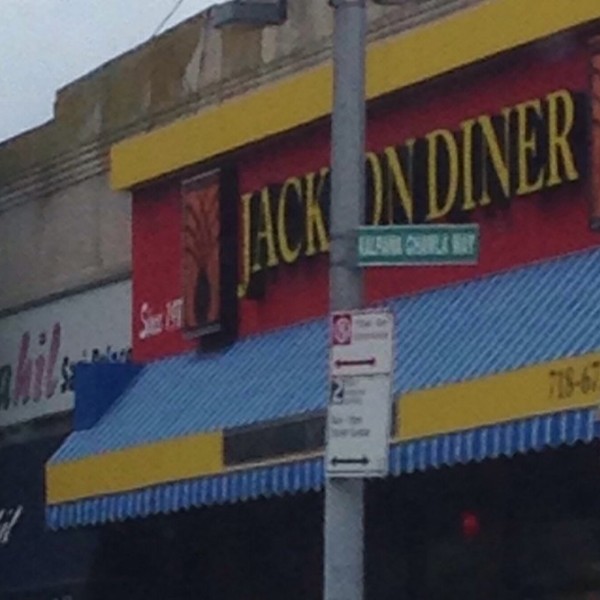
Where is `light`? The height and width of the screenshot is (600, 600). light is located at coordinates (246, 18).